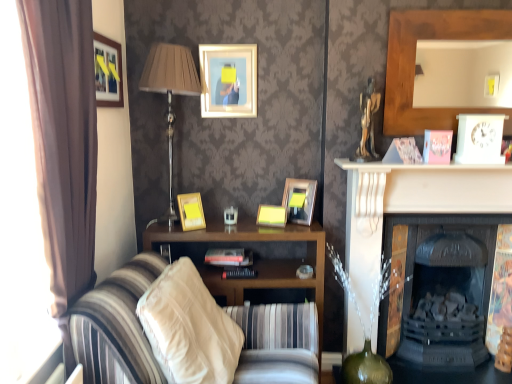
Question: Is yellow matte picture frame at center, the second picture frame positioned from the right, touching beige fabric pillow at lower center?

Choices:
 (A) yes
 (B) no

Answer: (B)

Question: Considering the relative sizes of yellow matte picture frame at center, the second picture frame positioned from the right, and beige fabric pillow at lower center in the image provided, is yellow matte picture frame at center, the second picture frame positioned from the right, smaller than beige fabric pillow at lower center?

Choices:
 (A) no
 (B) yes

Answer: (B)

Question: Is beige fabric pillow at lower center at the back of yellow matte picture frame at center, the fourth picture frame positioned from the left?

Choices:
 (A) yes
 (B) no

Answer: (B)

Question: From the image's perspective, is yellow matte picture frame at center, the fourth picture frame positioned from the left, located beneath beige fabric pillow at lower center?

Choices:
 (A) no
 (B) yes

Answer: (A)

Question: From the image's perspective, is yellow matte picture frame at center, the second picture frame positioned from the right, on beige fabric pillow at lower center?

Choices:
 (A) no
 (B) yes

Answer: (B)

Question: Considering the positions of hardcover book at center and striped fabric couch at center in the image, is hardcover book at center wider or thinner than striped fabric couch at center?

Choices:
 (A) thin
 (B) wide

Answer: (A)

Question: Is hardcover book at center in front of or behind striped fabric couch at center in the image?

Choices:
 (A) front
 (B) behind

Answer: (B)

Question: Is hardcover book at center taller or shorter than striped fabric couch at center?

Choices:
 (A) tall
 (B) short

Answer: (B)

Question: From the image's perspective, is hardcover book at center positioned above or below striped fabric couch at center?

Choices:
 (A) above
 (B) below

Answer: (A)

Question: From a real-world perspective, relative to yellow matte picture frame at center, the second picture frame positioned from the right, is matte gold picture frame at upper center, the 3th picture frame when ordered from left to right, vertically above or below?

Choices:
 (A) above
 (B) below

Answer: (A)

Question: In terms of size, does matte gold picture frame at upper center, which is counted as the third picture frame, starting from the right, appear bigger or smaller than yellow matte picture frame at center, the second picture frame positioned from the right?

Choices:
 (A) small
 (B) big

Answer: (B)

Question: Is point (215, 79) closer or farther from the camera than point (262, 221)?

Choices:
 (A) closer
 (B) farther

Answer: (B)

Question: From the image's perspective, relative to yellow matte picture frame at center, the fourth picture frame positioned from the left, is matte gold picture frame at upper center, which is counted as the third picture frame, starting from the right, above or below?

Choices:
 (A) above
 (B) below

Answer: (A)

Question: In the image, is yellow matte picture frame at center, the second picture frame positioned from the right, on the left side or the right side of beige fabric pillow at lower center?

Choices:
 (A) right
 (B) left

Answer: (A)

Question: Considering the positions of yellow matte picture frame at center, the second picture frame positioned from the right, and beige fabric pillow at lower center in the image, is yellow matte picture frame at center, the second picture frame positioned from the right, wider or thinner than beige fabric pillow at lower center?

Choices:
 (A) thin
 (B) wide

Answer: (A)